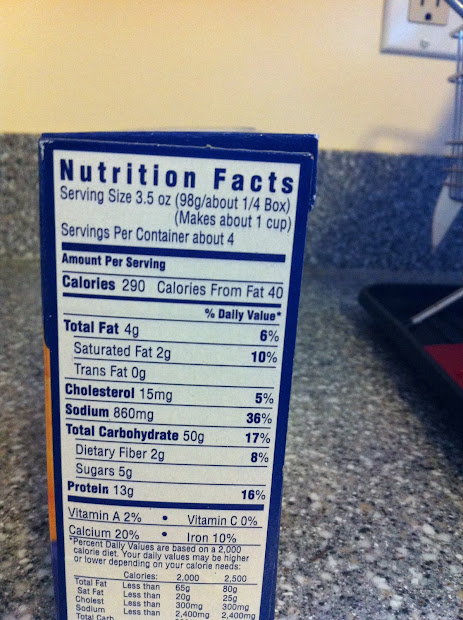
Locate an element on the screen. Image resolution: width=463 pixels, height=620 pixels. plug is located at coordinates (429, 7).